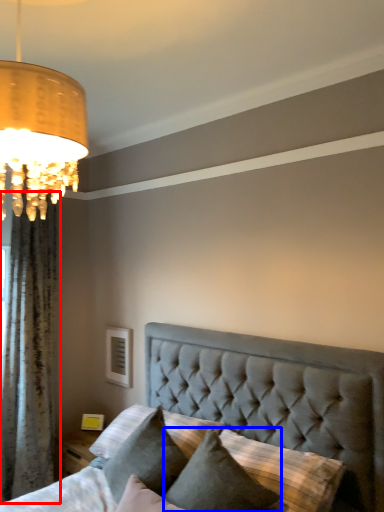
Question: Which point is further to the camera, curtain (highlighted by a red box) or pillow (highlighted by a blue box)?

Choices:
 (A) curtain
 (B) pillow

Answer: (A)